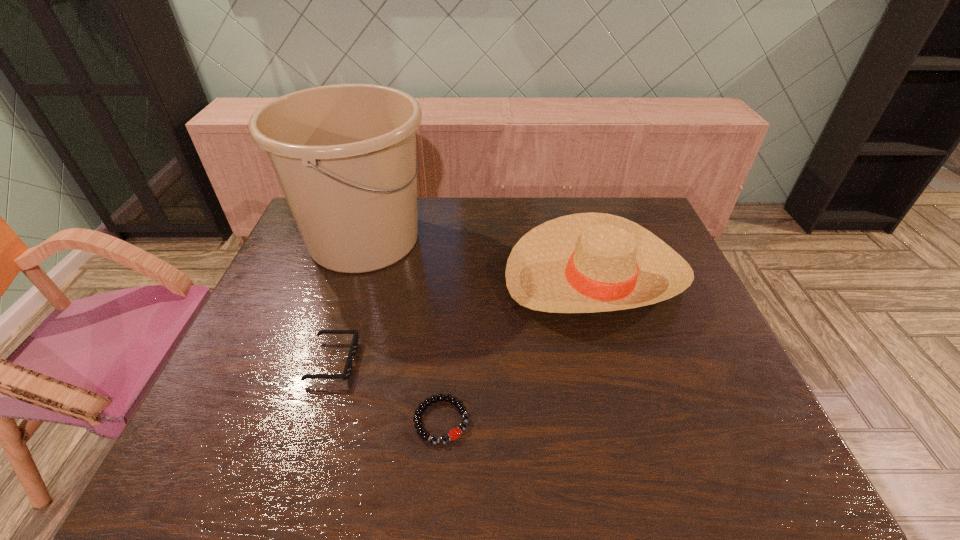
Where is `the tallest object`? the tallest object is located at coordinates (344, 155).

The height and width of the screenshot is (540, 960). Identify the location of the rightmost object. (591, 262).

Image resolution: width=960 pixels, height=540 pixels. I want to click on the second tallest object, so click(x=591, y=262).

Locate an element on the screen. the third farthest object is located at coordinates (346, 374).

The height and width of the screenshot is (540, 960). I want to click on sunglasses, so click(x=346, y=374).

The image size is (960, 540). In order to click on the nearest object in this screenshot , I will do `click(453, 434)`.

Where is `bracelet`? Image resolution: width=960 pixels, height=540 pixels. bracelet is located at coordinates [x=453, y=434].

This screenshot has width=960, height=540. What are the coordinates of `vacant region located on the right of the tallest object` in the screenshot? It's located at (509, 240).

Where is `free spot located on the left of the second tallest object`? This screenshot has height=540, width=960. free spot located on the left of the second tallest object is located at coordinates (383, 275).

Locate an element on the screen. The image size is (960, 540). vacant space situated 0.260m on the front-facing side of the sunglasses is located at coordinates (461, 361).